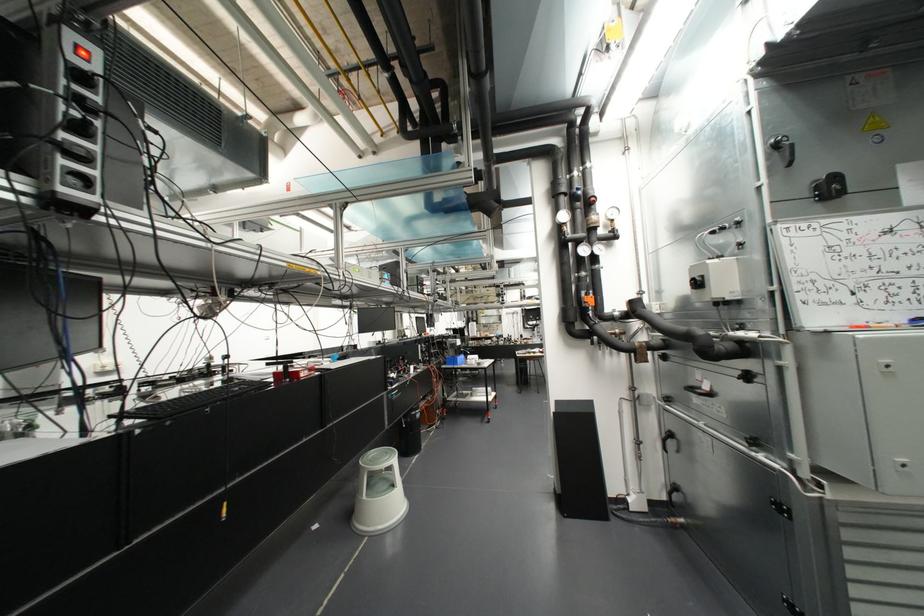
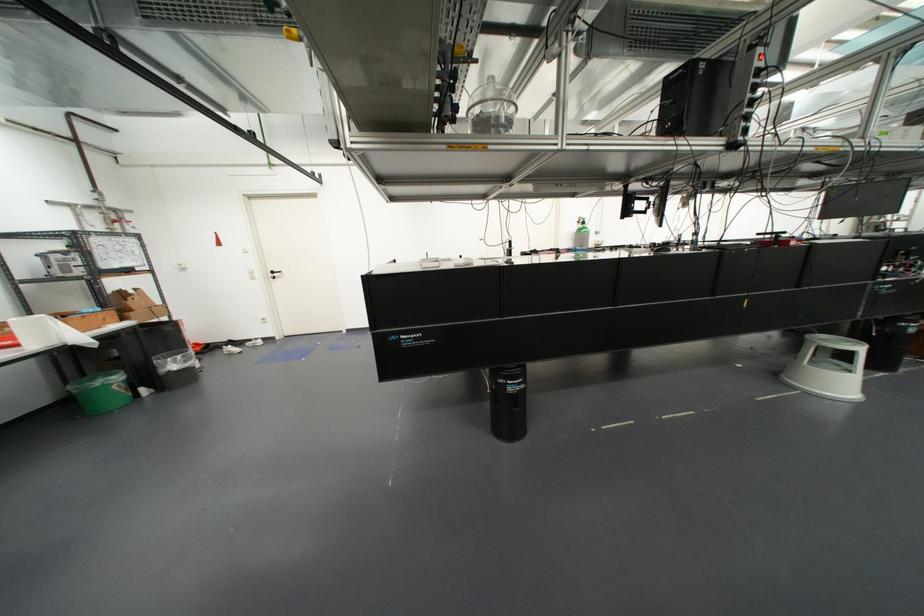
Where in the second image is the point corresponding to [388,506] from the first image?

(834, 384)